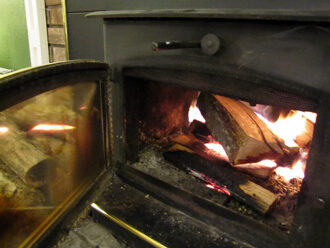
This screenshot has height=248, width=330. Identify the location of door. (32, 80).